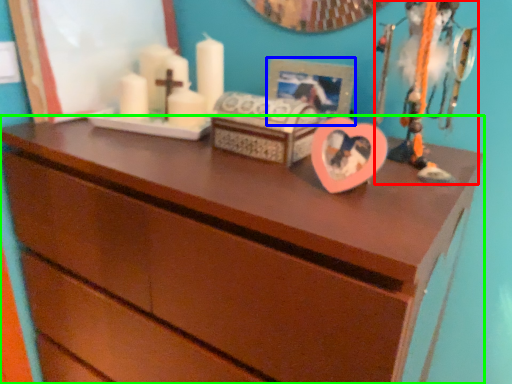
Question: Considering the real-world distances, which object is closest to toy (highlighted by a red box)? picture frame (highlighted by a blue box) or chest of drawers (highlighted by a green box).

Choices:
 (A) picture frame
 (B) chest of drawers

Answer: (A)